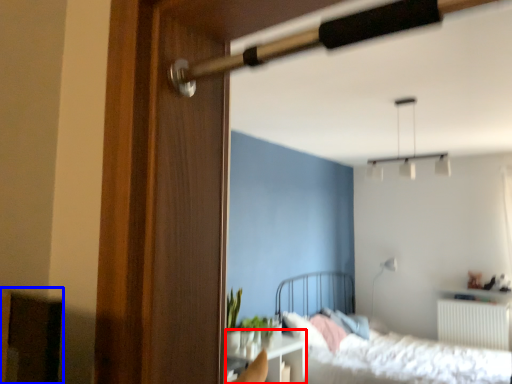
Question: Among these objects, which one is farthest to the camera, table (highlighted by a red box) or furniture (highlighted by a blue box)?

Choices:
 (A) table
 (B) furniture

Answer: (A)